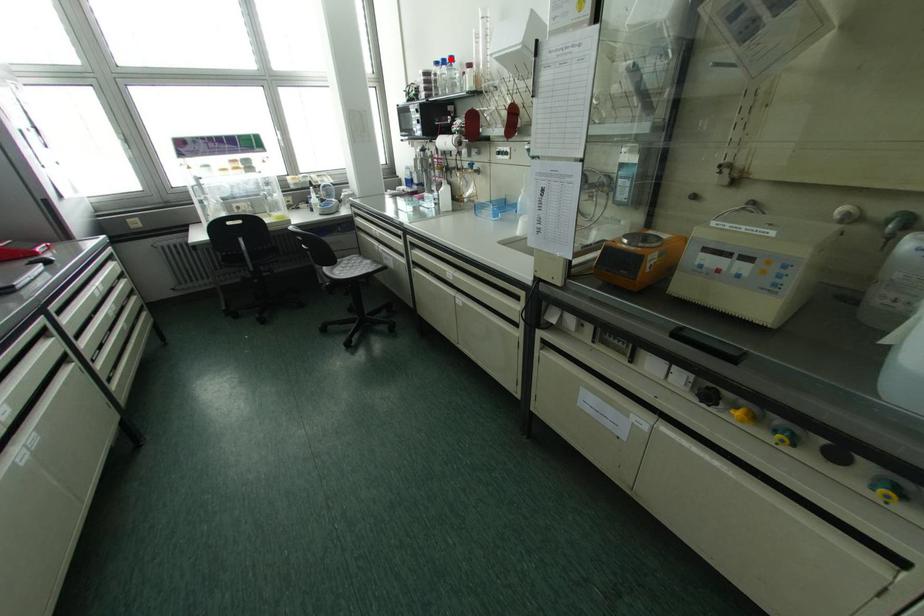
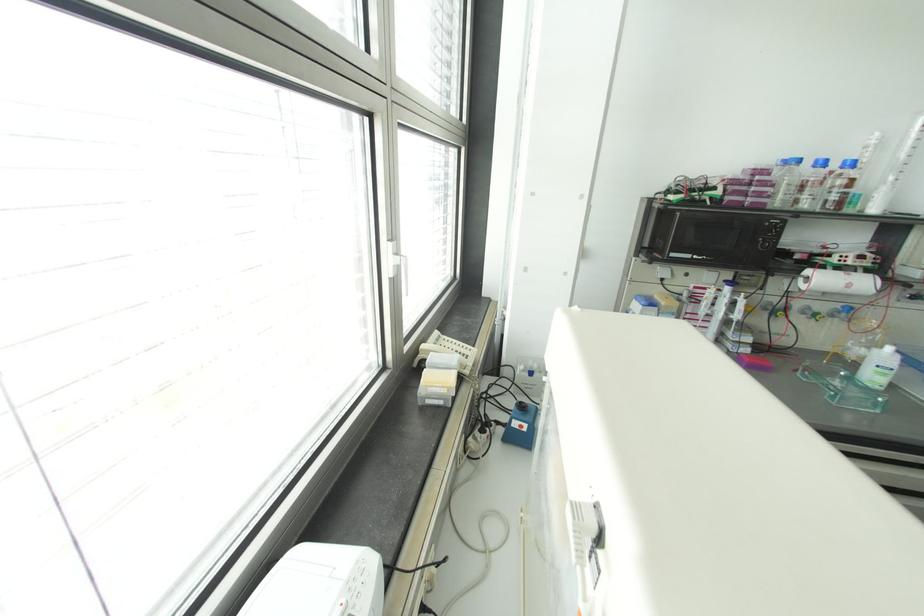
In the second image, find the point that corresponds to the highlighted location in the first image.

(852, 163)